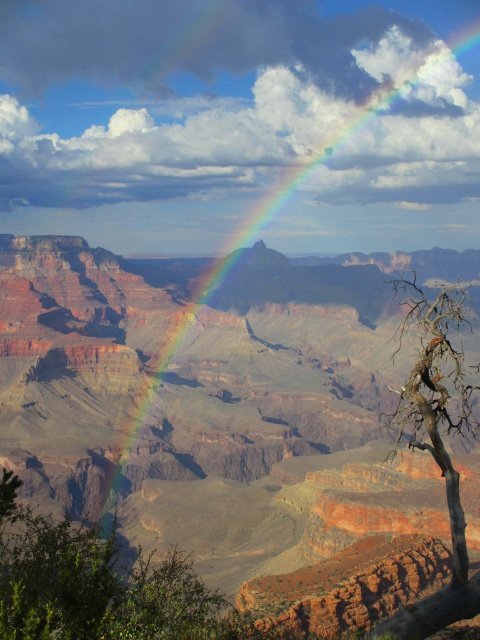
You are standing at the edge of the rustic sandstone canyon at center and want to take a photo of the dead wood tree at right. Which direction should you face to capture the tree in the background with the rainbow spanning from the left to the right?

You should face towards the dead wood tree at right. Since the rustic sandstone canyon at center is positioned over the dead wood tree at right, the tree will be visible behind the canyon. The rainbow starts from the left side of the frame and extends to the right, so facing the tree allows the rainbow to span from left to right in the photo.

You are an artist planning to paint the Grand Canyon scene. You want to ensure the dead wood tree at right is visible in your painting. Given that the rainbow at upper center is in front of it, how should you adjust the tree in your painting?

The dead wood tree at right is behind the rainbow at upper center, so to make it visible, you should paint the tree with lighter colors or less opacity so it can be seen through the rainbow.